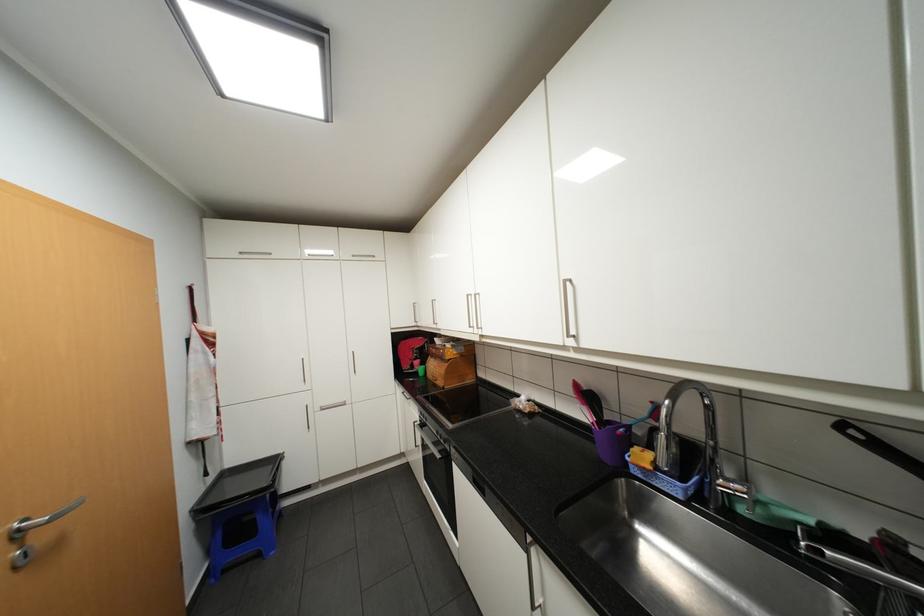
Where would you lift the faucet handle? Please return your answer as a coordinate pair (x, y).

(747, 496)